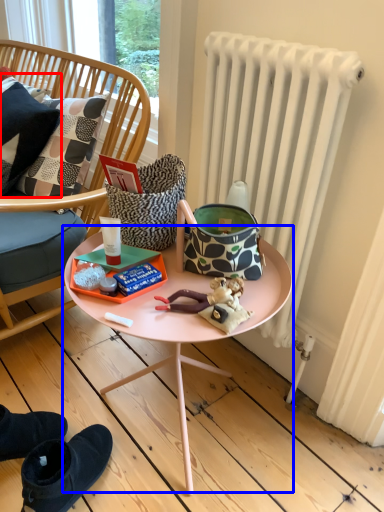
Question: Among these objects, which one is nearest to the camera, pillow (highlighted by a red box) or table (highlighted by a blue box)?

Choices:
 (A) pillow
 (B) table

Answer: (B)